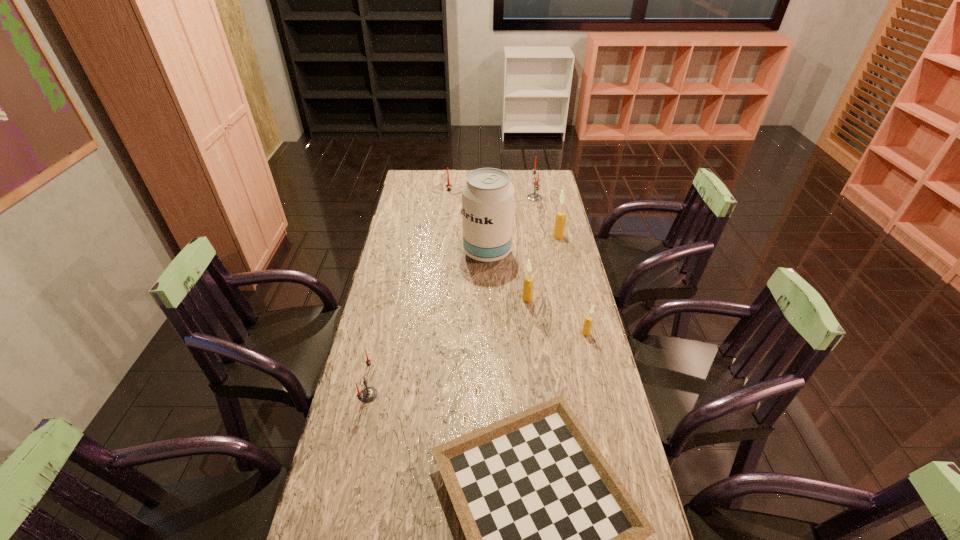
You are a GUI agent. You are given a task and a screenshot of the screen. Output one action in this format:
    pyautogui.click(x=<x>, y=<y>)
    Task: Click on the free space located on the front of the nearest cream candle
    The height and width of the screenshot is (540, 960).
    Given the screenshot: What is the action you would take?
    pyautogui.click(x=611, y=437)

The width and height of the screenshot is (960, 540). I want to click on vacant space located on the front-facing side of the nearest candle, so click(x=412, y=395).

This screenshot has width=960, height=540. What are the coordinates of `object present at the far edge` in the screenshot? It's located at (534, 196).

At what (x,y) coordinates should I click in order to perform the action: click on object located at the left edge. Please return your answer as a coordinate pair (x, y). Looking at the image, I should click on (368, 394).

This screenshot has height=540, width=960. I want to click on object present at the far right corner, so click(534, 196).

Locate an element on the screen. The width and height of the screenshot is (960, 540). vacant region at the left edge is located at coordinates (398, 432).

Locate an element on the screen. This screenshot has width=960, height=540. free space at the right edge of the desktop is located at coordinates (599, 382).

The height and width of the screenshot is (540, 960). Identify the location of vacant space at the far left corner of the desktop. (408, 171).

At what (x,y) coordinates should I click in order to perform the action: click on blank area at the far right corner. Please return your answer as a coordinate pair (x, y). The width and height of the screenshot is (960, 540). Looking at the image, I should click on (552, 171).

This screenshot has height=540, width=960. What are the coordinates of `free spot between the leftmost candle and the third nearest object` in the screenshot? It's located at (477, 364).